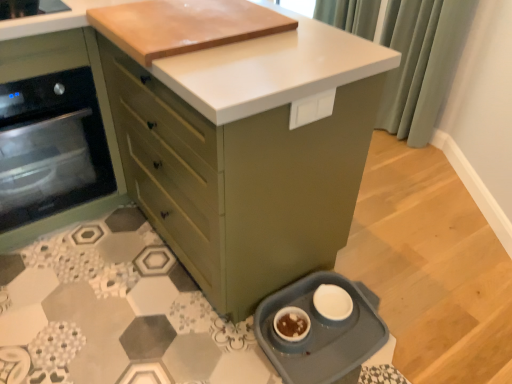
Identify the location of free area behind white matte bowl at lower center. The image size is (512, 384). (302, 298).